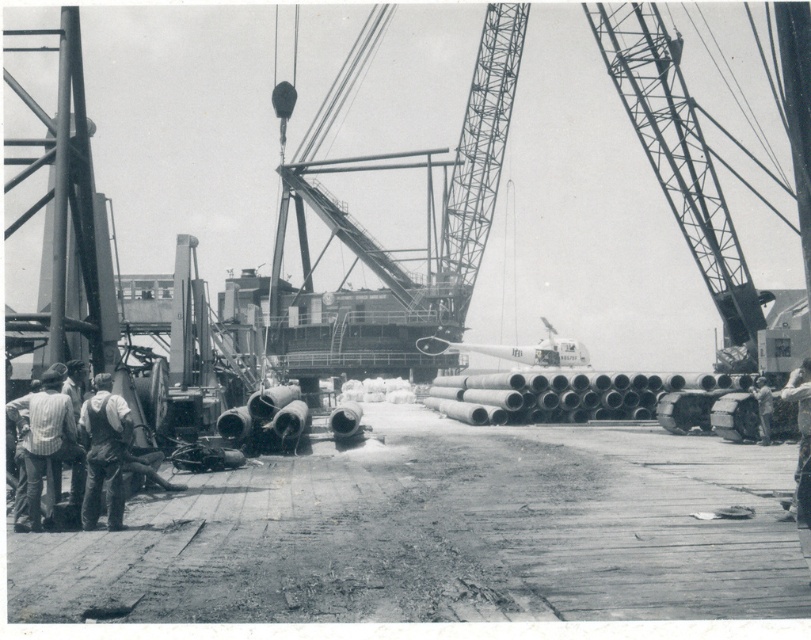
You are a safety inspector at the construction site. You need to ensure that the metallic gray crane at center is not obstructing the path of the worker in denim overalls at lower left. Can you confirm if the crane is positioned in a way that allows the worker to move freely underneath it?

The metallic gray crane at center is above denim overalls at lower left, so the crane is positioned directly over the worker, which means the worker cannot safely move underneath it without risk of the crane or its load causing harm. The crane is obstructing the worker.

Based on the scene description, where exactly are the smooth concrete pipes at lower left located in the image?

The smooth concrete pipes at lower left are located at point coordinates of (440, 532).

You are a safety inspector at the construction site. You need to ensure that the distance between the metallic gray crane at center and the striped shirt at left is at least 300 feet to comply with safety regulations. Based on the image, does the current distance meet the requirement?

The metallic gray crane at center and the striped shirt at left are 338.95 feet apart from each other, which exceeds the 300 feet requirement. Therefore, the safety regulation is met.